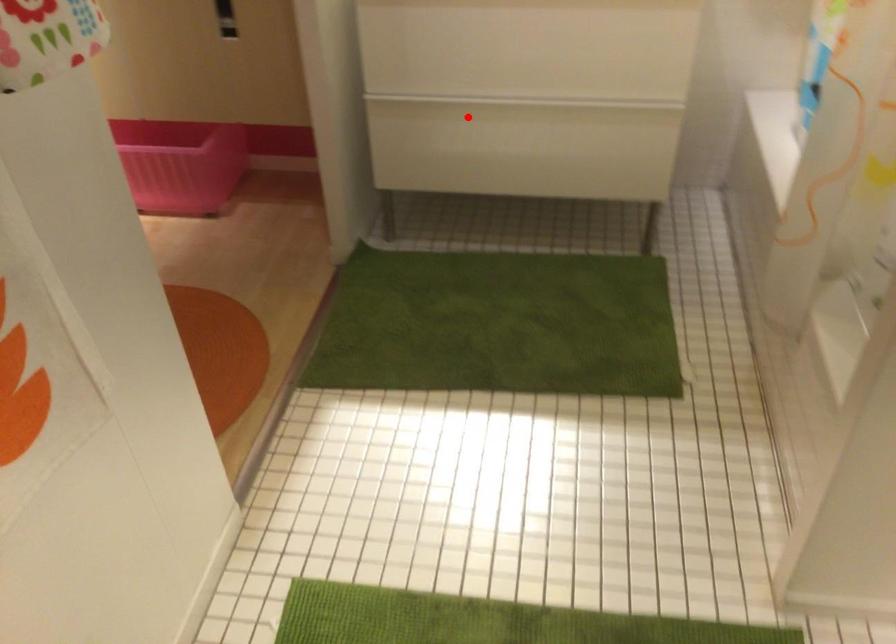
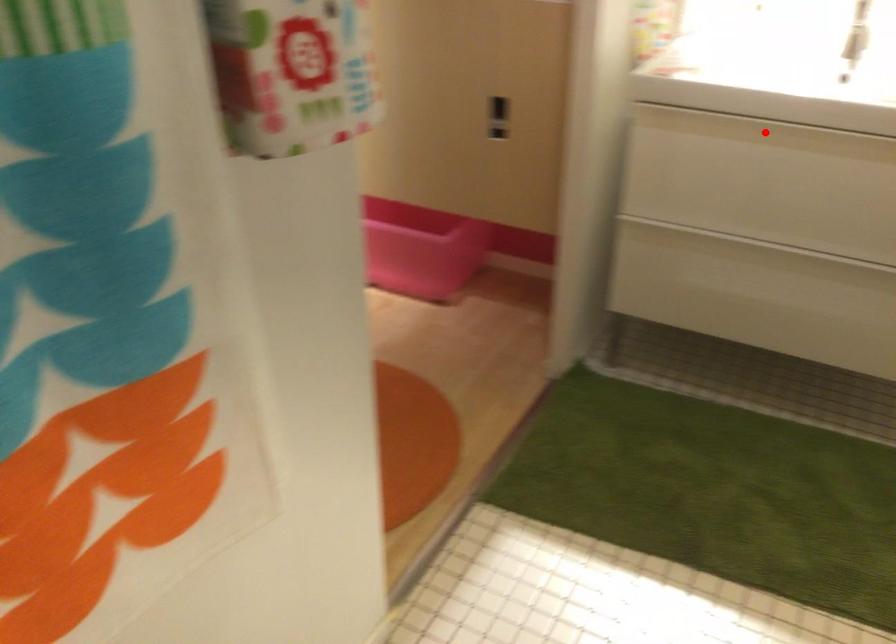
I am providing you with two images of the same scene from different viewpoints. A red point is marked on the first image and another point is marked on the second image. Is the red point in image1 aligned with the point shown in image2?

No